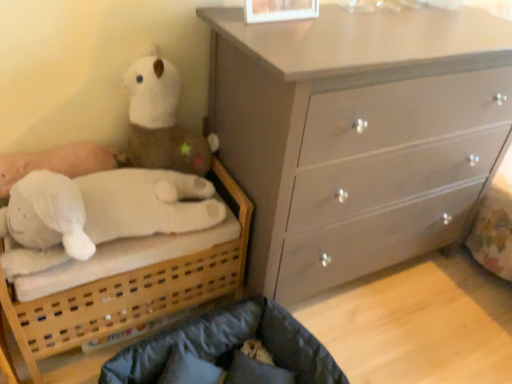
Question: Can you confirm if dark gray fabric infant bed at lower center is shorter than white plush toy at upper left?

Choices:
 (A) yes
 (B) no

Answer: (A)

Question: Considering the relative sizes of dark gray fabric infant bed at lower center and white plush toy at upper left in the image provided, is dark gray fabric infant bed at lower center smaller than white plush toy at upper left?

Choices:
 (A) no
 (B) yes

Answer: (A)

Question: Would you say dark gray fabric infant bed at lower center contains white plush toy at upper left?

Choices:
 (A) no
 (B) yes

Answer: (A)

Question: Can you confirm if dark gray fabric infant bed at lower center is taller than white plush toy at upper left?

Choices:
 (A) no
 (B) yes

Answer: (A)

Question: Can you confirm if dark gray fabric infant bed at lower center is positioned to the left of white plush toy at upper left?

Choices:
 (A) yes
 (B) no

Answer: (B)

Question: Looking at the image, does light gray wooden chest of drawers at upper right seem bigger or smaller compared to white soft bed at left?

Choices:
 (A) big
 (B) small

Answer: (A)

Question: Is light gray wooden chest of drawers at upper right taller or shorter than white soft bed at left?

Choices:
 (A) tall
 (B) short

Answer: (A)

Question: From the image's perspective, relative to white soft bed at left, is light gray wooden chest of drawers at upper right above or below?

Choices:
 (A) above
 (B) below

Answer: (A)

Question: From a real-world perspective, is light gray wooden chest of drawers at upper right positioned above or below white soft bed at left?

Choices:
 (A) below
 (B) above

Answer: (B)

Question: From their relative heights in the image, would you say white plush toy at left is taller or shorter than dark gray fabric infant bed at lower center?

Choices:
 (A) tall
 (B) short

Answer: (B)

Question: Based on their sizes in the image, would you say white plush toy at left is bigger or smaller than dark gray fabric infant bed at lower center?

Choices:
 (A) big
 (B) small

Answer: (B)

Question: Considering the positions of white plush toy at left and dark gray fabric infant bed at lower center in the image, is white plush toy at left wider or thinner than dark gray fabric infant bed at lower center?

Choices:
 (A) wide
 (B) thin

Answer: (B)

Question: Do you think white plush toy at left is within dark gray fabric infant bed at lower center, or outside of it?

Choices:
 (A) outside
 (B) inside

Answer: (A)

Question: In the image, is white soft bed at left positioned in front of or behind velvety dark blue pillow at lower center?

Choices:
 (A) behind
 (B) front

Answer: (B)

Question: Considering the positions of point (219, 264) and point (239, 352), is point (219, 264) closer or farther from the camera than point (239, 352)?

Choices:
 (A) farther
 (B) closer

Answer: (A)